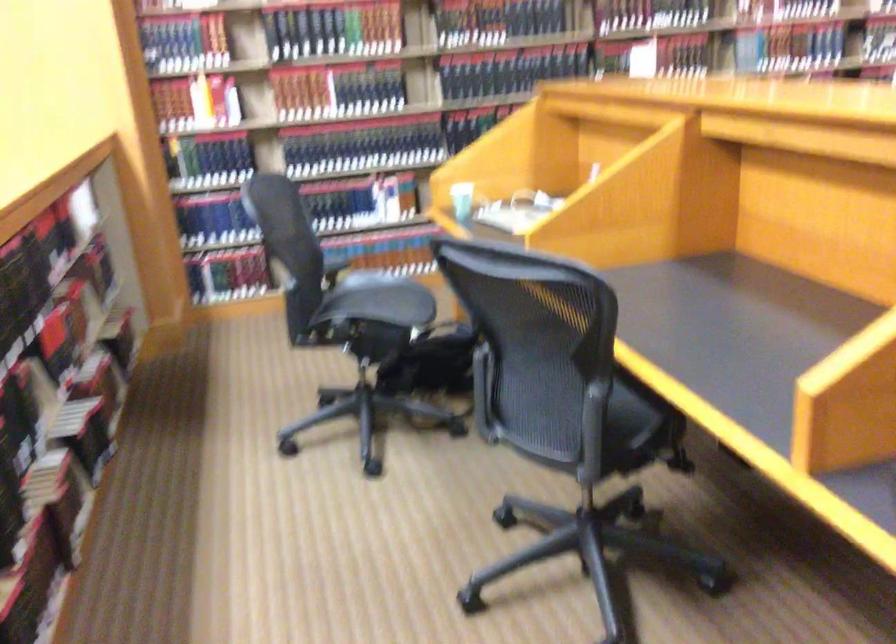
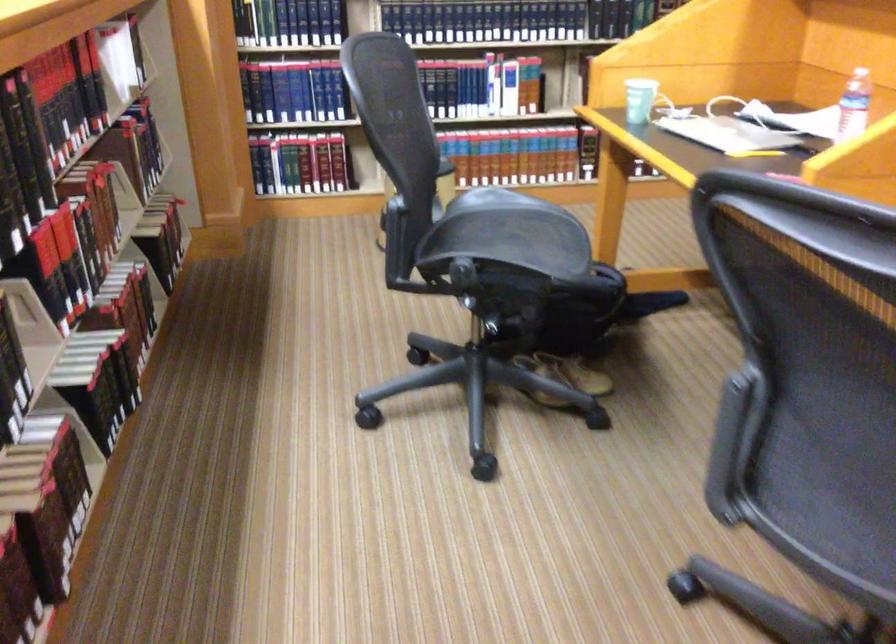
In the second image, find the point that corresponds to the point at 462,202 in the first image.

(640, 100)